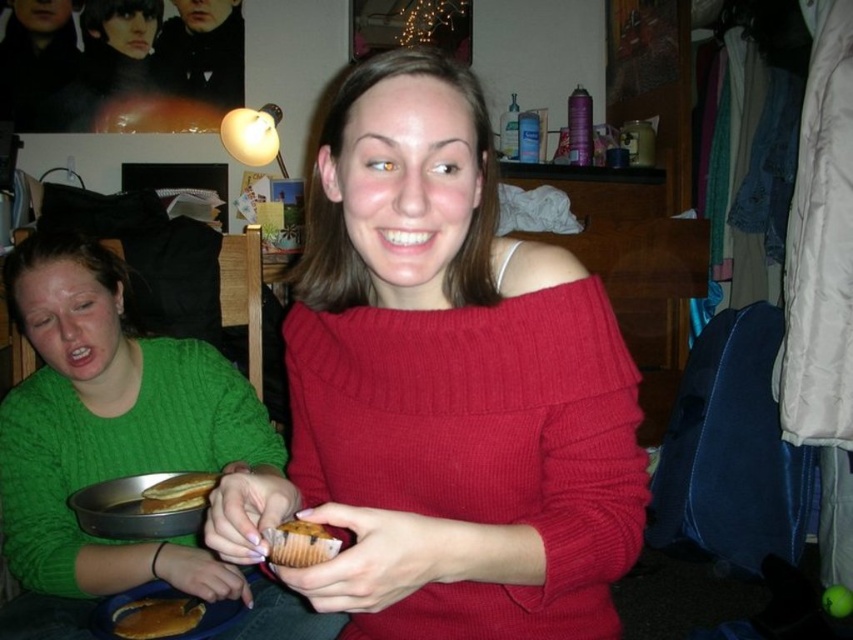
You are a photographer setting up for a portrait. You need to ensure that both the matte red sweater at center and the brown crumbly muffin at center are clearly visible in the frame. Based on their positions, which object should you focus on to ensure both are in focus?

The matte red sweater at center is in front of the brown crumbly muffin at center. To ensure both are in focus, you should focus on the matte red sweater at center since it is closer to the camera, and the depth of field will likely include the muffin behind it.

You are standing in front of the table where the two people are sitting. You want to place a small gift on the table. The gift must be placed closer to you than the edge of the table. Which of the two points, point (299,308) or point (180,604), should you choose?

You should choose point (299,308) because it is closer to the viewer than point (180,604), so placing the gift there would satisfy the requirement of being closer to you than the edge of the table.